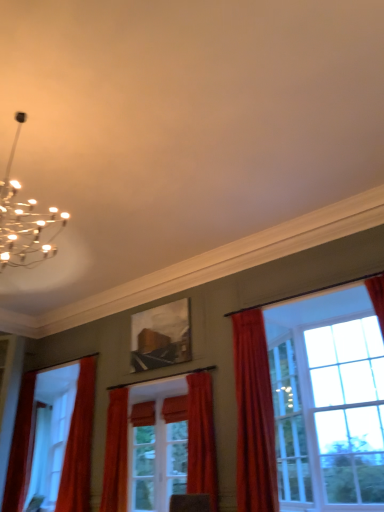
Question: Does velvet red curtain at right, which is counted as the 5th curtain, starting from the left, touch matte wooden picture frame at center?

Choices:
 (A) no
 (B) yes

Answer: (A)

Question: Considering the relative positions of velvet red curtain at right, the first curtain in the right-to-left sequence, and matte wooden picture frame at center in the image provided, is velvet red curtain at right, the first curtain in the right-to-left sequence, to the right of matte wooden picture frame at center from the viewer's perspective?

Choices:
 (A) yes
 (B) no

Answer: (A)

Question: From the image's perspective, is velvet red curtain at right, the first curtain in the right-to-left sequence, below matte wooden picture frame at center?

Choices:
 (A) no
 (B) yes

Answer: (B)

Question: Is the depth of velvet red curtain at right, the first curtain in the right-to-left sequence, greater than that of matte wooden picture frame at center?

Choices:
 (A) no
 (B) yes

Answer: (A)

Question: Considering the relative sizes of velvet red curtain at right, the first curtain in the right-to-left sequence, and matte wooden picture frame at center in the image provided, is velvet red curtain at right, the first curtain in the right-to-left sequence, thinner than matte wooden picture frame at center?

Choices:
 (A) yes
 (B) no

Answer: (B)

Question: In terms of height, does velvet red curtain at right, the first curtain in the right-to-left sequence, look taller or shorter compared to matte orange curtain at center, which is the 3th curtain from left to right?

Choices:
 (A) short
 (B) tall

Answer: (B)

Question: In terms of size, does velvet red curtain at right, which is counted as the 5th curtain, starting from the left, appear bigger or smaller than matte orange curtain at center, which is the 3th curtain from left to right?

Choices:
 (A) small
 (B) big

Answer: (B)

Question: Considering their positions, is velvet red curtain at right, the first curtain in the right-to-left sequence, located in front of or behind matte orange curtain at center, which is the 3th curtain from left to right?

Choices:
 (A) behind
 (B) front

Answer: (B)

Question: Is velvet red curtain at right, which is counted as the 5th curtain, starting from the left, situated inside matte orange curtain at center, which is the 3th curtain from left to right, or outside?

Choices:
 (A) outside
 (B) inside

Answer: (A)

Question: From the image's perspective, is orange velvet curtain at left, which is counted as the 4th curtain, starting from the right, positioned above or below matte wooden picture frame at center?

Choices:
 (A) above
 (B) below

Answer: (B)

Question: In terms of width, does orange velvet curtain at left, the second curtain in the left-to-right sequence, look wider or thinner when compared to matte wooden picture frame at center?

Choices:
 (A) wide
 (B) thin

Answer: (A)

Question: Is orange velvet curtain at left, the second curtain in the left-to-right sequence, to the left or to the right of matte wooden picture frame at center in the image?

Choices:
 (A) left
 (B) right

Answer: (A)

Question: Which is correct: orange velvet curtain at left, the second curtain in the left-to-right sequence, is inside matte wooden picture frame at center, or outside of it?

Choices:
 (A) inside
 (B) outside

Answer: (B)

Question: Visually, is clear glass screen door at center positioned to the left or to the right of matte wooden picture frame at center?

Choices:
 (A) left
 (B) right

Answer: (B)

Question: Do you think clear glass screen door at center is within matte wooden picture frame at center, or outside of it?

Choices:
 (A) inside
 (B) outside

Answer: (B)